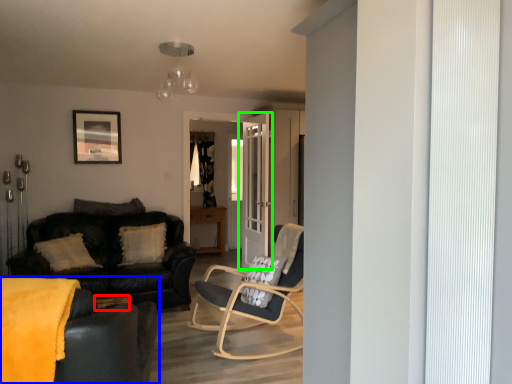
Question: Estimate the real-world distances between objects in this image. Which object is closer to side table (highlighted by a red box), studio couch (highlighted by a blue box) or door (highlighted by a green box)?

Choices:
 (A) studio couch
 (B) door

Answer: (A)